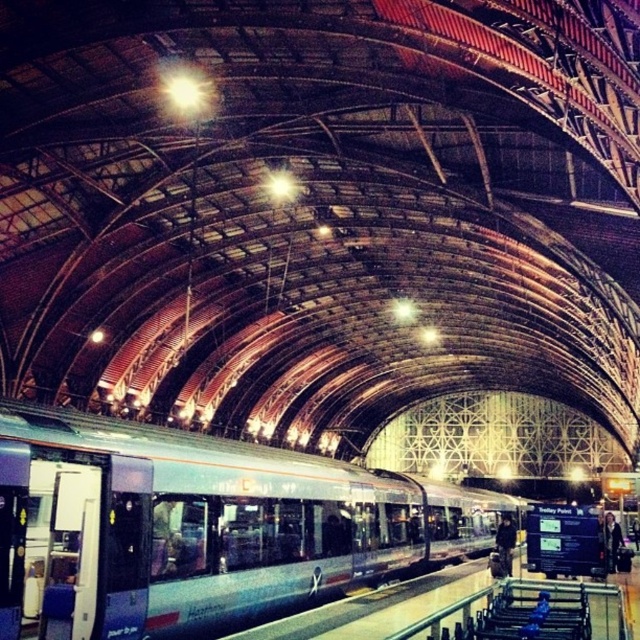
Which of these two, silver metallic train at center or dark brown leather jacket at center, stands shorter?

dark brown leather jacket at center

In the scene shown: Is silver metallic train at center below dark brown leather jacket at center?

Incorrect, silver metallic train at center is not positioned below dark brown leather jacket at center.

Measure the distance between point (52, 515) and camera.

They are 18.27 meters apart.

What are the coordinates of `silver metallic train at center` in the screenshot? It's located at (200, 525).

Does dark hair at platform right appear under dark brown leather jacket at center?

No.

Who is taller, dark hair at platform right or dark brown leather jacket at center?

With more height is dark brown leather jacket at center.

You are a GUI agent. You are given a task and a screenshot of the screen. Output one action in this format:
    pyautogui.click(x=<x>, y=<y>)
    Task: Click on the dark hair at platform right
    The height and width of the screenshot is (640, 640).
    Given the screenshot: What is the action you would take?
    pyautogui.click(x=611, y=540)

Is silver metallic train at center smaller than dark hair at platform right?

Actually, silver metallic train at center might be larger than dark hair at platform right.

Is silver metallic train at center positioned behind dark hair at platform right?

No, it is not.

Between point (108, 572) and point (618, 529), which one is positioned in front?

Point (108, 572) is more forward.

Locate an element on the screen. Image resolution: width=640 pixels, height=640 pixels. silver metallic train at center is located at coordinates (200, 525).